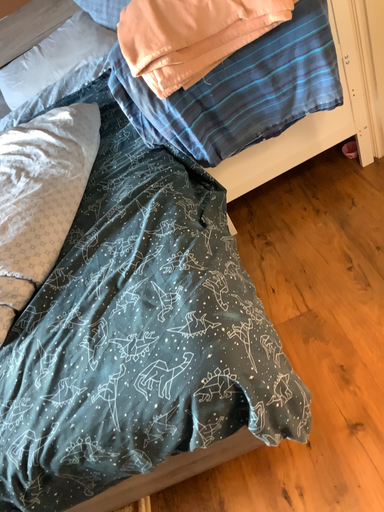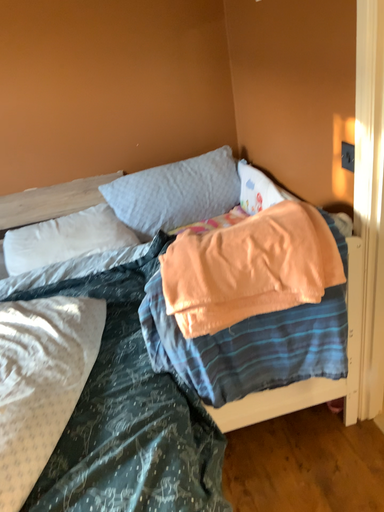
Question: Which way did the camera rotate in the video?

Choices:
 (A) rotated right
 (B) rotated left

Answer: (A)